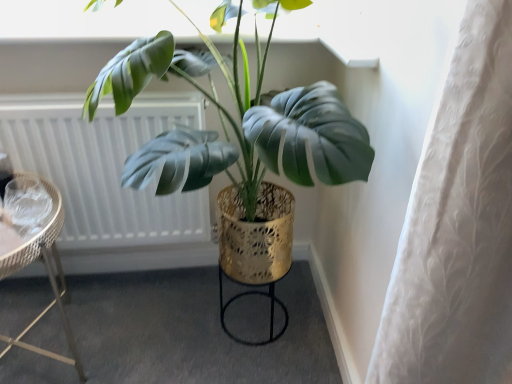
Question: Can you confirm if shiny gold pot at center is shorter than metallic wicker side table at left?

Choices:
 (A) no
 (B) yes

Answer: (A)

Question: Does shiny gold pot at center have a smaller size compared to metallic wicker side table at left?

Choices:
 (A) no
 (B) yes

Answer: (A)

Question: From the image's perspective, does shiny gold pot at center appear higher than metallic wicker side table at left?

Choices:
 (A) yes
 (B) no

Answer: (A)

Question: Considering the relative sizes of shiny gold pot at center and metallic wicker side table at left in the image provided, is shiny gold pot at center bigger than metallic wicker side table at left?

Choices:
 (A) no
 (B) yes

Answer: (B)

Question: Does shiny gold pot at center contain metallic wicker side table at left?

Choices:
 (A) no
 (B) yes

Answer: (A)

Question: From a real-world perspective, is metallic wicker side table at left physically located above or below gold textured stool at center?

Choices:
 (A) below
 (B) above

Answer: (B)

Question: Is point (11, 340) positioned closer to the camera than point (282, 304)?

Choices:
 (A) closer
 (B) farther

Answer: (A)

Question: From their relative heights in the image, would you say metallic wicker side table at left is taller or shorter than gold textured stool at center?

Choices:
 (A) tall
 (B) short

Answer: (A)

Question: Do you think metallic wicker side table at left is within gold textured stool at center, or outside of it?

Choices:
 (A) outside
 (B) inside

Answer: (A)

Question: Visually, is metallic wicker side table at left positioned to the left or to the right of shiny gold pot at center?

Choices:
 (A) right
 (B) left

Answer: (B)

Question: Is metallic wicker side table at left spatially inside shiny gold pot at center, or outside of it?

Choices:
 (A) inside
 (B) outside

Answer: (B)

Question: In the image, is metallic wicker side table at left positioned in front of or behind shiny gold pot at center?

Choices:
 (A) behind
 (B) front

Answer: (A)

Question: Based on their sizes in the image, would you say metallic wicker side table at left is bigger or smaller than shiny gold pot at center?

Choices:
 (A) small
 (B) big

Answer: (A)

Question: In terms of width, does shiny gold pot at center look wider or thinner when compared to gold textured stool at center?

Choices:
 (A) thin
 (B) wide

Answer: (B)

Question: From the image's perspective, is shiny gold pot at center above or below gold textured stool at center?

Choices:
 (A) above
 (B) below

Answer: (A)